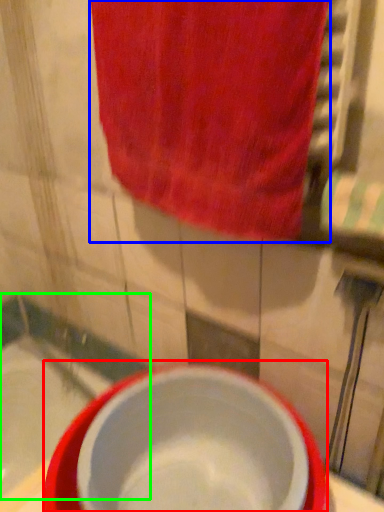
Question: Which object is positioned closest to basin (highlighted by a red box)? Select from towel (highlighted by a blue box) and bath (highlighted by a green box).

Choices:
 (A) towel
 (B) bath

Answer: (A)